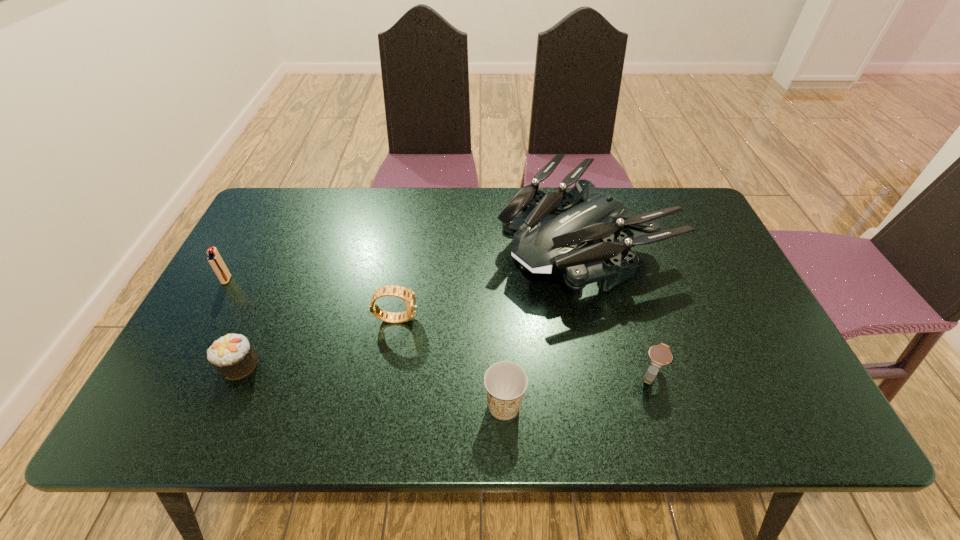
Where is `free area in between the igniter and the Dixie cup`? free area in between the igniter and the Dixie cup is located at coordinates (365, 343).

You are a GUI agent. You are given a task and a screenshot of the screen. Output one action in this format:
    pyautogui.click(x=<x>, y=<y>)
    Task: Click on the free spot between the left watch and the second object from left to right
    The height and width of the screenshot is (540, 960).
    Given the screenshot: What is the action you would take?
    pyautogui.click(x=318, y=341)

Where is `vacant space in between the drone and the shorter watch`? The height and width of the screenshot is (540, 960). vacant space in between the drone and the shorter watch is located at coordinates (615, 309).

The image size is (960, 540). What are the coordinates of `blank region between the taller watch and the drone` in the screenshot? It's located at (488, 280).

Select which object appears as the closest to the cupcake. Please provide its 2D coordinates. Your answer should be formatted as a tuple, i.e. [(x, y)], where the tuple contains the x and y coordinates of a point satisfying the conditions above.

[(216, 262)]

This screenshot has height=540, width=960. I want to click on object that is the nearest to the igniter, so click(x=232, y=355).

The image size is (960, 540). I want to click on free space that satisfies the following two spatial constraints: 1. on the back side of the tallest object; 2. on the right side of the second object from left to right, so click(294, 242).

Identify the location of free spot that satisfies the following two spatial constraints: 1. on the face of the left watch; 2. on the back side of the right watch. This screenshot has width=960, height=540. (386, 376).

Where is `blank space that satisfies the following two spatial constraints: 1. on the face of the third object from left to right; 2. on the front side of the cupcake`? This screenshot has height=540, width=960. blank space that satisfies the following two spatial constraints: 1. on the face of the third object from left to right; 2. on the front side of the cupcake is located at coordinates (388, 365).

The image size is (960, 540). I want to click on free location that satisfies the following two spatial constraints: 1. on the face of the fourth object from right to left; 2. on the back side of the shorter watch, so click(386, 376).